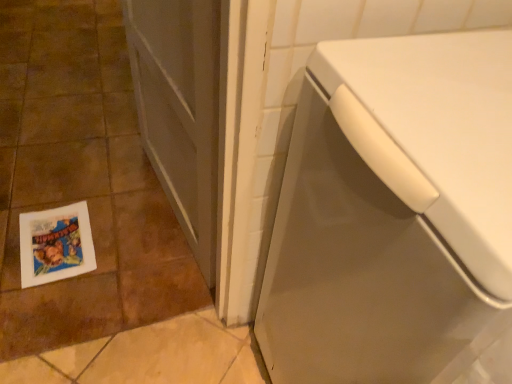
Question: Considering the relative positions of matte gray screen door at center and white paper flyer at lower left in the image provided, is matte gray screen door at center behind white paper flyer at lower left?

Choices:
 (A) yes
 (B) no

Answer: (B)

Question: From a real-world perspective, is matte gray screen door at center under white paper flyer at lower left?

Choices:
 (A) yes
 (B) no

Answer: (B)

Question: From the image's perspective, is matte gray screen door at center on top of white paper flyer at lower left?

Choices:
 (A) yes
 (B) no

Answer: (A)

Question: Considering the relative positions of matte gray screen door at center and white paper flyer at lower left in the image provided, is matte gray screen door at center to the left of white paper flyer at lower left from the viewer's perspective?

Choices:
 (A) no
 (B) yes

Answer: (A)

Question: Does matte gray screen door at center have a lesser height compared to white paper flyer at lower left?

Choices:
 (A) no
 (B) yes

Answer: (A)

Question: From their relative heights in the image, would you say white paper flyer at lower left is taller or shorter than white glossy tile at lower left?

Choices:
 (A) short
 (B) tall

Answer: (A)

Question: Is white paper flyer at lower left spatially inside white glossy tile at lower left, or outside of it?

Choices:
 (A) outside
 (B) inside

Answer: (B)

Question: Would you say white paper flyer at lower left is to the left or to the right of white glossy tile at lower left in the picture?

Choices:
 (A) right
 (B) left

Answer: (A)

Question: Is point (48, 241) closer or farther from the camera than point (60, 130)?

Choices:
 (A) closer
 (B) farther

Answer: (A)

Question: Is white glossy washing machine at lower right taller or shorter than matte gray screen door at center?

Choices:
 (A) short
 (B) tall

Answer: (B)

Question: From the image's perspective, is white glossy washing machine at lower right above or below matte gray screen door at center?

Choices:
 (A) above
 (B) below

Answer: (B)

Question: Considering the positions of point (305, 150) and point (214, 38), is point (305, 150) closer or farther from the camera than point (214, 38)?

Choices:
 (A) closer
 (B) farther

Answer: (A)

Question: From a real-world perspective, is white glossy washing machine at lower right above or below matte gray screen door at center?

Choices:
 (A) above
 (B) below

Answer: (A)

Question: Do you think white glossy tile at lower left is within matte gray screen door at center, or outside of it?

Choices:
 (A) inside
 (B) outside

Answer: (B)

Question: Based on their sizes in the image, would you say white glossy tile at lower left is bigger or smaller than matte gray screen door at center?

Choices:
 (A) small
 (B) big

Answer: (B)